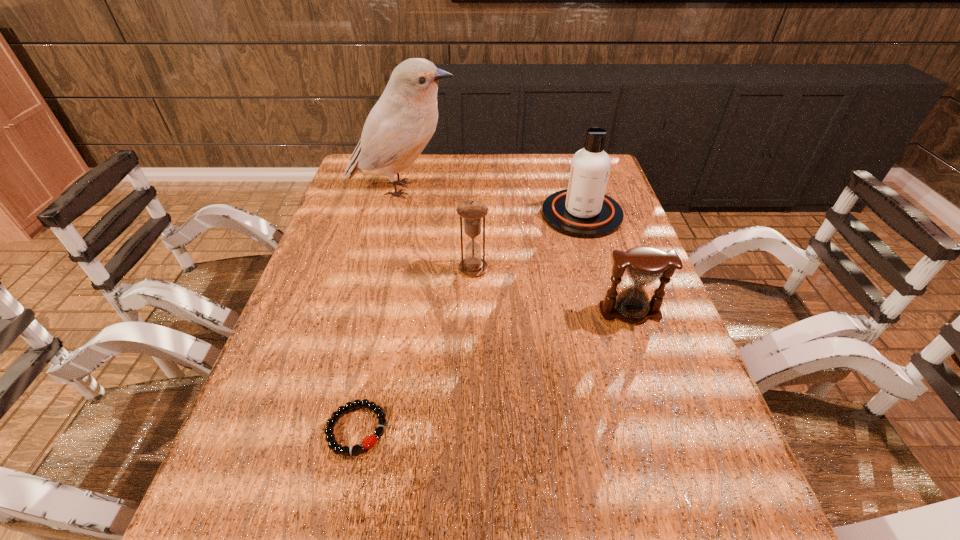
At what (x,y) coordinates should I click in order to perform the action: click on vacant space that satisfies the following two spatial constraints: 1. on the face of the tallest object; 2. on the left side of the third object from left to right. Please return your answer as a coordinate pair (x, y). Looking at the image, I should click on (383, 268).

Image resolution: width=960 pixels, height=540 pixels. I want to click on blank area in the image that satisfies the following two spatial constraints: 1. on the face of the parakeet; 2. on the back side of the cleansing agent, so click(396, 214).

Identify the location of free spot that satisfies the following two spatial constraints: 1. on the face of the parakeet; 2. on the right side of the cleansing agent. The width and height of the screenshot is (960, 540). (396, 214).

I want to click on free space that satisfies the following two spatial constraints: 1. on the face of the shortest object; 2. on the right side of the tallest object, so click(345, 429).